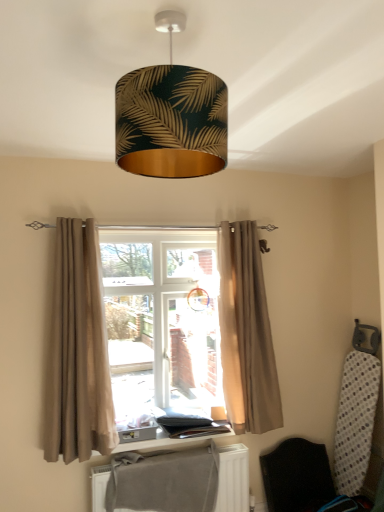
Find the location of a particular element. free space above gold leaf-patterned lampshade at upper center (from a real-world perspective) is located at coordinates (180, 20).